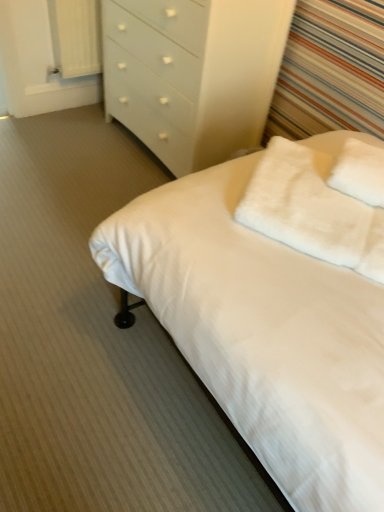
The image size is (384, 512). What do you see at coordinates (193, 74) in the screenshot?
I see `white glossy chest of drawers at upper center` at bounding box center [193, 74].

In order to click on white soft bed at center in this screenshot , I will do `click(262, 333)`.

Who is smaller, white glossy chest of drawers at upper center or white fabric curtain at upper left?

white fabric curtain at upper left is smaller.

Is white glossy chest of drawers at upper center turned away from white fabric curtain at upper left?

That's not correct — white glossy chest of drawers at upper center is not looking away from white fabric curtain at upper left.

Is white fabric curtain at upper left completely or partially inside white glossy chest of drawers at upper center?

No.

From a real-world perspective, is white glossy chest of drawers at upper center on white fabric curtain at upper left?

Answer: Indeed, from a real-world perspective, white glossy chest of drawers at upper center stands above white fabric curtain at upper left.

Can you confirm if white fabric curtain at upper left is smaller than white fluffy pillow at upper right, marked as the 1th pillow in a left-to-right arrangement?

Actually, white fabric curtain at upper left might be larger than white fluffy pillow at upper right, marked as the 1th pillow in a left-to-right arrangement.

Does white fabric curtain at upper left have a greater width compared to white fluffy pillow at upper right, marked as the 1th pillow in a left-to-right arrangement?

No.

Measure the distance from white fluffy pillow at upper right, acting as the 2th pillow starting from the left, to white soft bed at center.

The distance of white fluffy pillow at upper right, acting as the 2th pillow starting from the left, from white soft bed at center is 40.48 centimeters.

Would you consider white fluffy pillow at upper right, acting as the 2th pillow starting from the left, to be distant from white soft bed at center?

white fluffy pillow at upper right, acting as the 2th pillow starting from the left, is near white soft bed at center, not far away.

Is white fluffy pillow at upper right, acting as the 2th pillow starting from the left, located outside white soft bed at center?

white fluffy pillow at upper right, acting as the 2th pillow starting from the left, lies outside white soft bed at center's area.

Which is more to the left, white fluffy pillow at upper right, marked as the first pillow in a right-to-left arrangement, or white soft bed at center?

white soft bed at center.

Is white fluffy pillow at upper right, which appears as the second pillow when viewed from the right, at the back of white soft bed at center?

No, white fluffy pillow at upper right, which appears as the second pillow when viewed from the right, is not at the back of white soft bed at center.

Considering the sizes of objects white soft bed at center and white fluffy pillow at upper right, marked as the 1th pillow in a left-to-right arrangement, in the image provided, who is wider, white soft bed at center or white fluffy pillow at upper right, marked as the 1th pillow in a left-to-right arrangement,?

white soft bed at center.

In the image, is white soft bed at center on the left side or the right side of white fluffy pillow at upper right, marked as the 1th pillow in a left-to-right arrangement?

Clearly, white soft bed at center is on the left of white fluffy pillow at upper right, marked as the 1th pillow in a left-to-right arrangement, in the image.

Measure the distance between white soft bed at center and white fluffy pillow at upper right, which appears as the second pillow when viewed from the right.

The distance of white soft bed at center from white fluffy pillow at upper right, which appears as the second pillow when viewed from the right, is 6.63 inches.

Does white fluffy pillow at upper right, marked as the first pillow in a right-to-left arrangement, touch white fabric curtain at upper left?

No, white fluffy pillow at upper right, marked as the first pillow in a right-to-left arrangement, is not in contact with white fabric curtain at upper left.

Which is more to the left, white fluffy pillow at upper right, marked as the first pillow in a right-to-left arrangement, or white fabric curtain at upper left?

white fabric curtain at upper left is more to the left.

Considering the positions of objects white fluffy pillow at upper right, marked as the first pillow in a right-to-left arrangement, and white fabric curtain at upper left in the image provided, who is in front, white fluffy pillow at upper right, marked as the first pillow in a right-to-left arrangement, or white fabric curtain at upper left?

white fluffy pillow at upper right, marked as the first pillow in a right-to-left arrangement.

From the image's perspective, which one is positioned higher, white fluffy pillow at upper right, acting as the 2th pillow starting from the left, or white fabric curtain at upper left?

From the image's view, white fabric curtain at upper left is above.

From the picture: Based on their positions, is white fluffy pillow at upper right, which appears as the second pillow when viewed from the right, located to the left or right of white glossy chest of drawers at upper center?

Clearly, white fluffy pillow at upper right, which appears as the second pillow when viewed from the right, is on the right of white glossy chest of drawers at upper center in the image.

What's the angular difference between white fluffy pillow at upper right, which appears as the second pillow when viewed from the right, and white glossy chest of drawers at upper center's facing directions?

31.4 degrees.

From a real-world perspective, relative to white glossy chest of drawers at upper center, is white fluffy pillow at upper right, marked as the 1th pillow in a left-to-right arrangement, vertically above or below?

white fluffy pillow at upper right, marked as the 1th pillow in a left-to-right arrangement, is above white glossy chest of drawers at upper center.

From the picture: Considering the sizes of white fluffy pillow at upper right, marked as the 1th pillow in a left-to-right arrangement, and white glossy chest of drawers at upper center in the image, is white fluffy pillow at upper right, marked as the 1th pillow in a left-to-right arrangement, wider or thinner than white glossy chest of drawers at upper center?

white fluffy pillow at upper right, marked as the 1th pillow in a left-to-right arrangement, is thinner than white glossy chest of drawers at upper center.

Considering the sizes of white fluffy pillow at upper right, which appears as the second pillow when viewed from the right, and white fabric curtain at upper left in the image, is white fluffy pillow at upper right, which appears as the second pillow when viewed from the right, bigger or smaller than white fabric curtain at upper left?

Considering their sizes, white fluffy pillow at upper right, which appears as the second pillow when viewed from the right, takes up less space than white fabric curtain at upper left.

From the image's perspective, starting from the white fabric curtain at upper left, which pillow is the 2nd one below? Please provide its 2D coordinates.

[(312, 210)]

Is white fluffy pillow at upper right, marked as the 1th pillow in a left-to-right arrangement, thinner than white fabric curtain at upper left?

In fact, white fluffy pillow at upper right, marked as the 1th pillow in a left-to-right arrangement, might be wider than white fabric curtain at upper left.

Locate an element on the screen. The image size is (384, 512). curtain on the left of white glossy chest of drawers at upper center is located at coordinates (75, 36).

Find the location of a particular element. The image size is (384, 512). pillow that is the 2nd one when counting downward from the white fabric curtain at upper left (from the image's perspective) is located at coordinates (312, 210).

Based on their spatial positions, is white fluffy pillow at upper right, which appears as the second pillow when viewed from the right, or white fluffy pillow at upper right, acting as the 2th pillow starting from the left, closer to white soft bed at center?

white fluffy pillow at upper right, which appears as the second pillow when viewed from the right, lies closer to white soft bed at center than the other object.

Consider the image. Looking at the image, which one is located further to white fluffy pillow at upper right, marked as the first pillow in a right-to-left arrangement, white fabric curtain at upper left or white soft bed at center?

white fabric curtain at upper left is positioned further to the anchor white fluffy pillow at upper right, marked as the first pillow in a right-to-left arrangement.

Based on their spatial positions, is white soft bed at center or white glossy chest of drawers at upper center further from white fluffy pillow at upper right, marked as the first pillow in a right-to-left arrangement?

Based on the image, white glossy chest of drawers at upper center appears to be further to white fluffy pillow at upper right, marked as the first pillow in a right-to-left arrangement.

From the image, which object appears to be farther from white glossy chest of drawers at upper center, white fabric curtain at upper left or white fluffy pillow at upper right, which appears as the second pillow when viewed from the right?

white fluffy pillow at upper right, which appears as the second pillow when viewed from the right, is positioned further to the anchor white glossy chest of drawers at upper center.

Considering their positions, is white fluffy pillow at upper right, which appears as the second pillow when viewed from the right, positioned further to white fabric curtain at upper left than white fluffy pillow at upper right, marked as the first pillow in a right-to-left arrangement?

white fluffy pillow at upper right, marked as the first pillow in a right-to-left arrangement, is further to white fabric curtain at upper left.

Based on their spatial positions, is white soft bed at center or white fluffy pillow at upper right, which appears as the second pillow when viewed from the right, further from white fluffy pillow at upper right, acting as the 2th pillow starting from the left?

The object further to white fluffy pillow at upper right, acting as the 2th pillow starting from the left, is white soft bed at center.

Estimate the real-world distances between objects in this image. Which object is further from white fluffy pillow at upper right, marked as the 1th pillow in a left-to-right arrangement, white fabric curtain at upper left or white soft bed at center?

Among the two, white fabric curtain at upper left is located further to white fluffy pillow at upper right, marked as the 1th pillow in a left-to-right arrangement.

Which object lies further to the anchor point white fluffy pillow at upper right, which appears as the second pillow when viewed from the right, white soft bed at center or white fabric curtain at upper left?

white fabric curtain at upper left.

Image resolution: width=384 pixels, height=512 pixels. What are the coordinates of `pillow located between white soft bed at center and white fluffy pillow at upper right, acting as the 2th pillow starting from the left, in the left-right direction` in the screenshot? It's located at [312, 210].

Image resolution: width=384 pixels, height=512 pixels. Find the location of `chest of drawers between white soft bed at center and white fluffy pillow at upper right, marked as the first pillow in a right-to-left arrangement, from left to right`. chest of drawers between white soft bed at center and white fluffy pillow at upper right, marked as the first pillow in a right-to-left arrangement, from left to right is located at coordinates (193, 74).

Identify the location of chest of drawers between white fluffy pillow at upper right, marked as the 1th pillow in a left-to-right arrangement, and white fabric curtain at upper left, along the z-axis. The image size is (384, 512). (193, 74).

The image size is (384, 512). In order to click on pillow situated between white fabric curtain at upper left and white fluffy pillow at upper right, marked as the first pillow in a right-to-left arrangement, from left to right in this screenshot , I will do `click(312, 210)`.